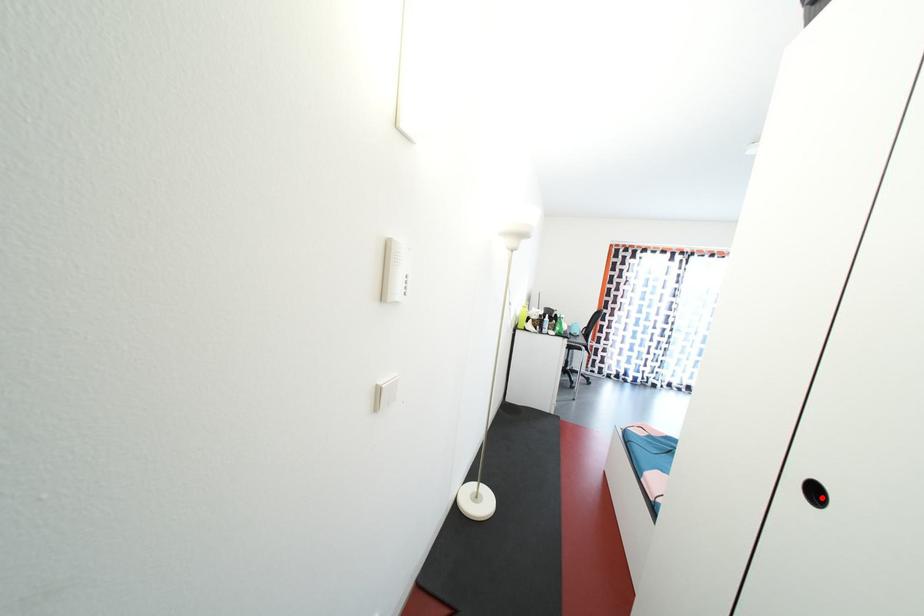
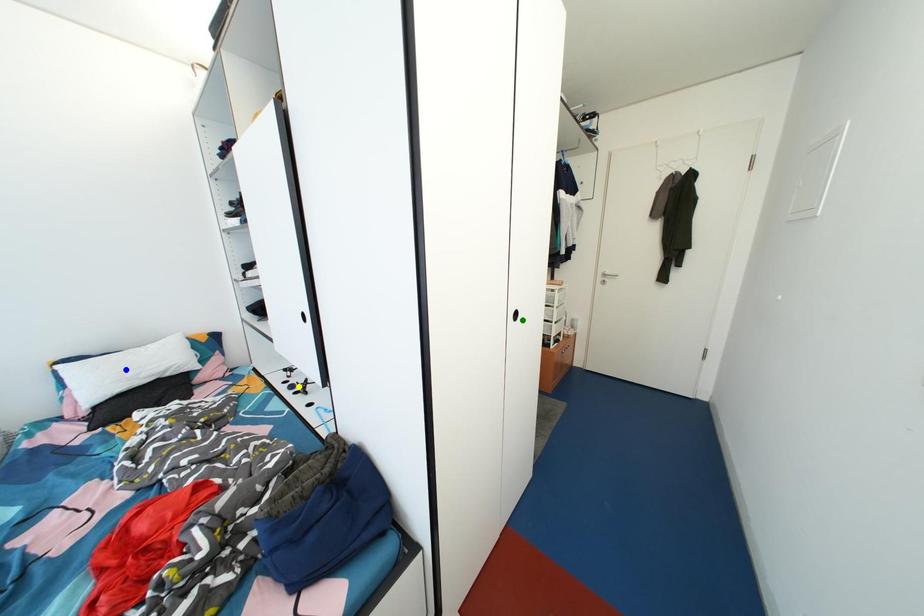
Question: I am providing you with two images of the same scene from different viewpoints. A red point is marked on the first image. You are given multiple points on the second image. Can you choose the point in image 2 that corresponds to the point in image 1?

Choices:
 (A) green point
 (B) yellow point
 (C) blue point

Answer: (A)